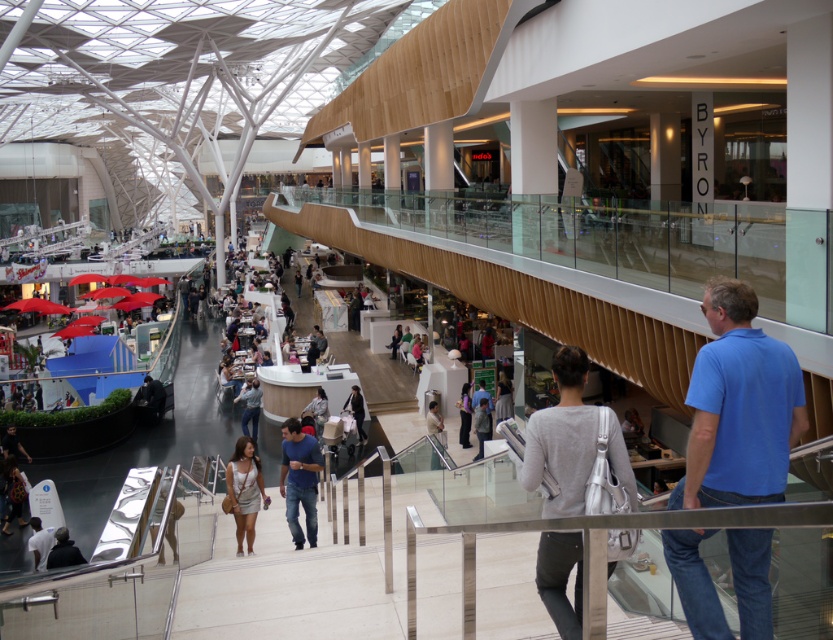
Question: Which point is farther to the camera?

Choices:
 (A) white fabric at lower left
 (B) blue jeans at center

Answer: (A)

Question: Does dark gray jacket at lower left have a smaller size compared to matte black pants at center?

Choices:
 (A) no
 (B) yes

Answer: (B)

Question: Is blue cotton shirt at right positioned at the back of light brown leather skirt at center?

Choices:
 (A) no
 (B) yes

Answer: (A)

Question: Which object is the closest to the light brown leather skirt at center?

Choices:
 (A) white fabric at lower left
 (B) black leather jacket at center
 (C) denim jeans at center
 (D) dark gray pants at center

Answer: (A)

Question: Does blue cotton shirt at right appear under blue jeans at center?

Choices:
 (A) yes
 (B) no

Answer: (B)

Question: Which of the following is the farthest from the observer?

Choices:
 (A) (47, 552)
 (B) (734, 568)
 (C) (298, 493)

Answer: (A)